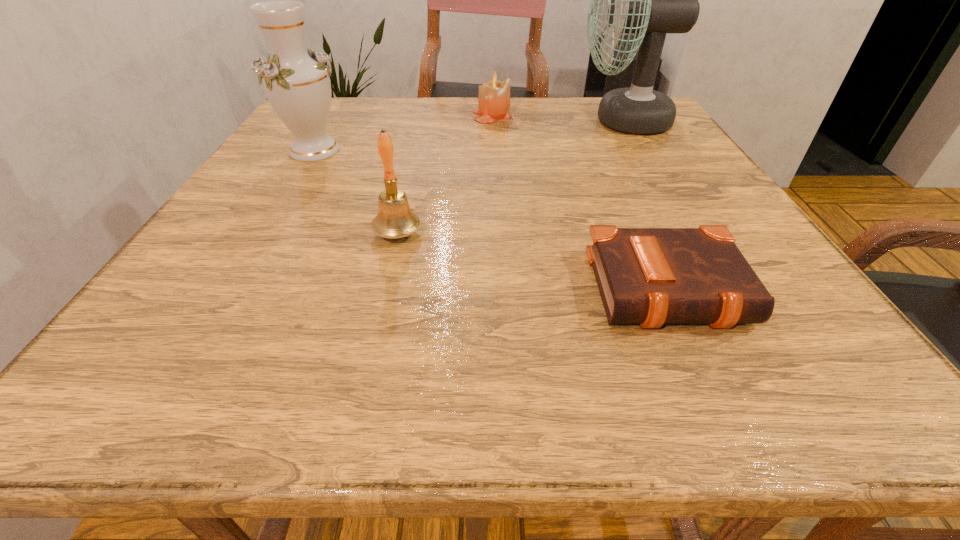
Locate an element on the screen. This screenshot has height=540, width=960. vacant space located in front of the tallest object where the airflow is directed is located at coordinates (502, 121).

You are a GUI agent. You are given a task and a screenshot of the screen. Output one action in this format:
    pyautogui.click(x=<x>, y=<y>)
    Task: Click on the vacant position located in front of the tallest object where the airflow is directed
    This screenshot has width=960, height=540.
    Given the screenshot: What is the action you would take?
    pyautogui.click(x=533, y=121)

At what (x,y) coordinates should I click in order to perform the action: click on vacant area situated on the right of the second tallest object. Please return your answer as a coordinate pair (x, y). The image size is (960, 540). Looking at the image, I should click on (514, 151).

Where is `vacant space situated on the right of the fourth farthest object`? Image resolution: width=960 pixels, height=540 pixels. vacant space situated on the right of the fourth farthest object is located at coordinates (500, 234).

The height and width of the screenshot is (540, 960). Identify the location of vacant position located 0.310m on the front of the second shortest object. (495, 186).

The height and width of the screenshot is (540, 960). I want to click on fan that is at the far edge, so click(649, 0).

This screenshot has width=960, height=540. I want to click on candle present at the far edge, so click(494, 96).

Find the location of a particular element. The width and height of the screenshot is (960, 540). object that is at the left edge is located at coordinates (296, 81).

Find the location of a particular element. fan that is at the right edge is located at coordinates (649, 0).

Where is `Bible present at the right edge`? This screenshot has width=960, height=540. Bible present at the right edge is located at coordinates (648, 276).